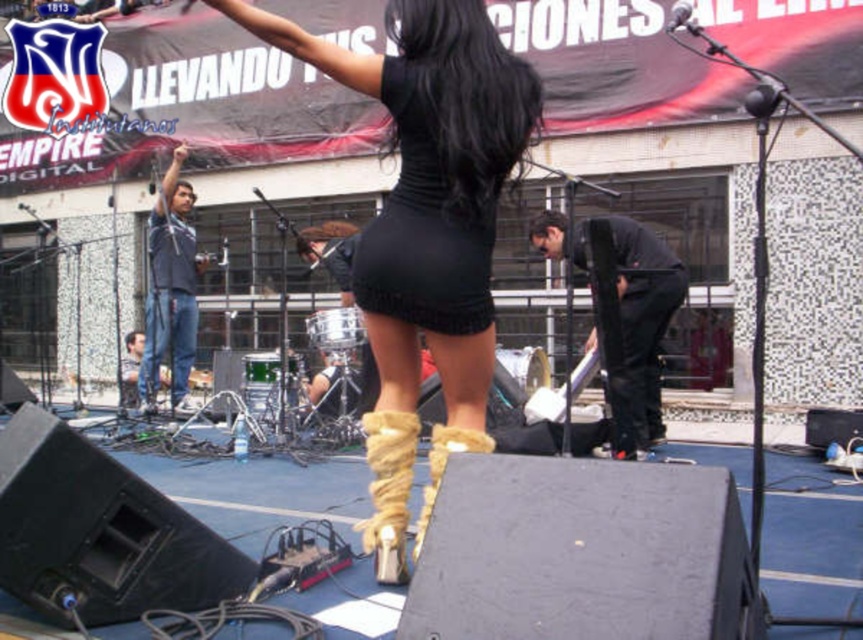
Question: Is black knit dress at center further to the viewer compared to jeans at center?

Choices:
 (A) yes
 (B) no

Answer: (B)

Question: Which point is farther to the camera?

Choices:
 (A) black knit dress at center
 (B) leather high-heeled boot at center
 (C) tan suede boot at center
 (D) black matte pants at right

Answer: (D)

Question: Which point is closer to the camera?

Choices:
 (A) (435, 317)
 (B) (637, 292)

Answer: (A)

Question: Which point is farther to the camera?

Choices:
 (A) (637, 365)
 (B) (389, 355)
 (C) (432, 493)
 (D) (457, 268)

Answer: (A)

Question: Can you confirm if black knit dress at center is positioned above leather high-heeled boot at center?

Choices:
 (A) yes
 (B) no

Answer: (A)

Question: Where is black knit dress at center located in relation to tan suede boot at center in the image?

Choices:
 (A) below
 (B) above

Answer: (B)